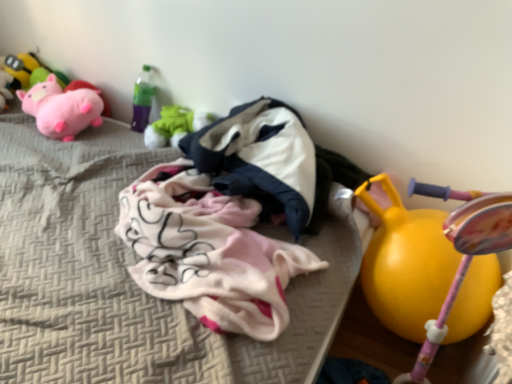
Image resolution: width=512 pixels, height=384 pixels. In order to click on rubber yellow ball at right, which is counted as the fifth toy, starting from the left in this screenshot , I will do `click(405, 262)`.

Measure the distance between rubber yellow ball at right, which is counted as the fifth toy, starting from the left, and camera.

The depth of rubber yellow ball at right, which is counted as the fifth toy, starting from the left, is 1.10 meters.

Measure the distance between point [346,256] and camera.

Point [346,256] is 4.04 feet from camera.

Describe the element at coordinates (21, 68) in the screenshot. The height and width of the screenshot is (384, 512). I see `matte yellow toy at upper left, which is counted as the 5th toy, starting from the right` at that location.

Locate an element on the screen. Image resolution: width=512 pixels, height=384 pixels. matte pink plush at upper left, the third toy from the left is located at coordinates (62, 108).

This screenshot has width=512, height=384. Find the location of `soft pink plush at upper left, positioned as the second toy in left-to-right order`. soft pink plush at upper left, positioned as the second toy in left-to-right order is located at coordinates (29, 71).

Considering the relative sizes of matte yellow toy at upper left, arranged as the first toy when viewed from the left, and matte pink plush at upper left, the third toy from the left, in the image provided, is matte yellow toy at upper left, arranged as the first toy when viewed from the left, wider than matte pink plush at upper left, the third toy from the left,?

Incorrect, the width of matte yellow toy at upper left, arranged as the first toy when viewed from the left, does not surpass that of matte pink plush at upper left, the third toy from the left.

Can you confirm if matte yellow toy at upper left, which is counted as the 5th toy, starting from the right, is shorter than matte pink plush at upper left, the third toy from the left?

In fact, matte yellow toy at upper left, which is counted as the 5th toy, starting from the right, may be taller than matte pink plush at upper left, the third toy from the left.

Is matte yellow toy at upper left, arranged as the first toy when viewed from the left, aimed at matte pink plush at upper left, the third toy from the left?

No, matte yellow toy at upper left, arranged as the first toy when viewed from the left, does not turn towards matte pink plush at upper left, the third toy from the left.

From the image's perspective, which is above, matte yellow toy at upper left, which is counted as the 5th toy, starting from the right, or matte pink plush at upper left, the third toy from the left?

From the image's view, matte yellow toy at upper left, which is counted as the 5th toy, starting from the right, is above.

Considering the sizes of objects rubber yellow ball at right, which is counted as the fifth toy, starting from the left, and white fabric at center in the image provided, who is smaller, rubber yellow ball at right, which is counted as the fifth toy, starting from the left, or white fabric at center?

rubber yellow ball at right, which is counted as the fifth toy, starting from the left, is smaller.

Is rubber yellow ball at right, which is counted as the fifth toy, starting from the left, taller or shorter than white fabric at center?

In the image, rubber yellow ball at right, which is counted as the fifth toy, starting from the left, appears to be taller than white fabric at center.

From the picture: Considering the positions of objects rubber yellow ball at right, which is counted as the fifth toy, starting from the left, and white fabric at center in the image provided, who is in front, rubber yellow ball at right, which is counted as the fifth toy, starting from the left, or white fabric at center?

white fabric at center is more forward.

Is the depth of soft pink plush at upper left, acting as the fourth toy starting from the right, less than that of rubber yellow ball at right, which is counted as the fifth toy, starting from the left?

No, it is not.

From a real-world perspective, relative to rubber yellow ball at right, placed as the 1th toy when sorted from right to left, is soft pink plush at upper left, positioned as the second toy in left-to-right order, vertically above or below?

soft pink plush at upper left, positioned as the second toy in left-to-right order, is situated higher than rubber yellow ball at right, placed as the 1th toy when sorted from right to left, in the real world.

Does point (58, 83) appear closer or farther from the camera than point (415, 277)?

Point (58, 83).

Does soft pink plush at upper left, acting as the fourth toy starting from the right, appear on the left side of rubber yellow ball at right, which is counted as the fifth toy, starting from the left?

Correct, you'll find soft pink plush at upper left, acting as the fourth toy starting from the right, to the left of rubber yellow ball at right, which is counted as the fifth toy, starting from the left.

Is point (117, 303) in front of point (263, 125)?

Yes, it is in front of point (263, 125).

Can you tell me how much white fabric at center and white cotton hoodie at center differ in facing direction?

2.96e-05 degrees.

From the image's perspective, is white fabric at center below white cotton hoodie at center?

Yes.

Does white fabric at center have a larger size compared to white cotton hoodie at center?

Correct, white fabric at center is larger in size than white cotton hoodie at center.

Considering the sizes of objects white cotton hoodie at center and white fabric at center in the image provided, who is taller, white cotton hoodie at center or white fabric at center?

Standing taller between the two is white cotton hoodie at center.

Which of these two, white cotton hoodie at center or white fabric at center, is smaller?

white cotton hoodie at center.

Which is more to the right, white cotton hoodie at center or white fabric at center?

From the viewer's perspective, white cotton hoodie at center appears more on the right side.

Could you tell me if white cotton hoodie at center is turned towards white fabric at center?

Yes, white cotton hoodie at center is aimed at white fabric at center.

Which is more to the left, white cotton hoodie at center or rubber yellow ball at right, placed as the 1th toy when sorted from right to left?

white cotton hoodie at center is more to the left.

From the picture: Is white cotton hoodie at center smaller than rubber yellow ball at right, which is counted as the fifth toy, starting from the left?

No, white cotton hoodie at center is not smaller than rubber yellow ball at right, which is counted as the fifth toy, starting from the left.

Is white cotton hoodie at center next to rubber yellow ball at right, which is counted as the fifth toy, starting from the left, and touching it?

No, white cotton hoodie at center is not next to rubber yellow ball at right, which is counted as the fifth toy, starting from the left.

What's the angular difference between white cotton hoodie at center and rubber yellow ball at right, which is counted as the fifth toy, starting from the left,'s facing directions?

There is a 1.08-degree angle between the facing directions of white cotton hoodie at center and rubber yellow ball at right, which is counted as the fifth toy, starting from the left.

Could you tell me if rubber yellow ball at right, which is counted as the fifth toy, starting from the left, is turned towards white cotton hoodie at center?

No, rubber yellow ball at right, which is counted as the fifth toy, starting from the left, is not facing towards white cotton hoodie at center.

Based on the photo, from the image's perspective, which one is positioned higher, rubber yellow ball at right, which is counted as the fifth toy, starting from the left, or white cotton hoodie at center?

white cotton hoodie at center appears higher in the image.

Considering the relative sizes of rubber yellow ball at right, placed as the 1th toy when sorted from right to left, and white cotton hoodie at center in the image provided, is rubber yellow ball at right, placed as the 1th toy when sorted from right to left, taller than white cotton hoodie at center?

Indeed, rubber yellow ball at right, placed as the 1th toy when sorted from right to left, has a greater height compared to white cotton hoodie at center.

Would you say rubber yellow ball at right, placed as the 1th toy when sorted from right to left, is to the left or to the right of white cotton hoodie at center in the picture?

Clearly, rubber yellow ball at right, placed as the 1th toy when sorted from right to left, is on the right of white cotton hoodie at center in the image.

Where is `toy that is the 2nd one above the matte pink plush at upper left, which ranks as the 3th toy in right-to-left order (from a real-world perspective)`? The image size is (512, 384). toy that is the 2nd one above the matte pink plush at upper left, which ranks as the 3th toy in right-to-left order (from a real-world perspective) is located at coordinates (21, 68).

Where is `the 1st toy behind the white fabric at center, starting your count from the anchor`? the 1st toy behind the white fabric at center, starting your count from the anchor is located at coordinates (405, 262).

From the image, which object appears to be nearer to rubber yellow ball at right, which is counted as the fifth toy, starting from the left, matte green plush toy at upper left, which appears as the fourth toy when viewed from the left, or white fabric at center?

Among the two, white fabric at center is located nearer to rubber yellow ball at right, which is counted as the fifth toy, starting from the left.

When comparing their distances from soft pink plush at upper left, positioned as the second toy in left-to-right order, does matte yellow toy at upper left, which is counted as the 5th toy, starting from the right, or matte pink plush at upper left, the third toy from the left, seem closer?

Among the two, matte yellow toy at upper left, which is counted as the 5th toy, starting from the right, is located nearer to soft pink plush at upper left, positioned as the second toy in left-to-right order.

Looking at the image, which one is located closer to matte yellow toy at upper left, which is counted as the 5th toy, starting from the right, matte pink plush at upper left, which ranks as the 3th toy in right-to-left order, or white cotton hoodie at center?

The object closer to matte yellow toy at upper left, which is counted as the 5th toy, starting from the right, is matte pink plush at upper left, which ranks as the 3th toy in right-to-left order.

Looking at this image, considering their positions, is matte pink plush at upper left, which ranks as the 3th toy in right-to-left order, positioned further to soft pink plush at upper left, positioned as the second toy in left-to-right order, than white cotton hoodie at center?

white cotton hoodie at center is further to soft pink plush at upper left, positioned as the second toy in left-to-right order.

Estimate the real-world distances between objects in this image. Which object is further from rubber yellow ball at right, placed as the 1th toy when sorted from right to left, matte pink plush at upper left, which ranks as the 3th toy in right-to-left order, or white fabric at center?

Based on the image, matte pink plush at upper left, which ranks as the 3th toy in right-to-left order, appears to be further to rubber yellow ball at right, placed as the 1th toy when sorted from right to left.

Estimate the real-world distances between objects in this image. Which object is further from matte green plush toy at upper left, marked as the 2th toy in a right-to-left arrangement, white fabric at center or soft pink plush at upper left, positioned as the second toy in left-to-right order?

soft pink plush at upper left, positioned as the second toy in left-to-right order, is positioned further to the anchor matte green plush toy at upper left, marked as the 2th toy in a right-to-left arrangement.

Considering their positions, is white cotton hoodie at center positioned further to matte pink plush at upper left, the third toy from the left, than matte yellow toy at upper left, which is counted as the 5th toy, starting from the right?

The object further to matte pink plush at upper left, the third toy from the left, is white cotton hoodie at center.

Which object lies further to the anchor point white fabric at center, matte yellow toy at upper left, arranged as the first toy when viewed from the left, or soft pink plush at upper left, acting as the fourth toy starting from the right?

matte yellow toy at upper left, arranged as the first toy when viewed from the left, is positioned further to the anchor white fabric at center.

I want to click on mattress between matte pink plush at upper left, the third toy from the left, and white cotton hoodie at center, in the horizontal direction, so click(x=129, y=277).

At what (x,y) coordinates should I click in order to perform the action: click on mattress between matte pink plush at upper left, the third toy from the left, and rubber yellow ball at right, placed as the 1th toy when sorted from right to left, in the horizontal direction. Please return your answer as a coordinate pair (x, y). Looking at the image, I should click on (129, 277).

The height and width of the screenshot is (384, 512). Find the location of `toy between matte pink plush at upper left, the third toy from the left, and white cotton hoodie at center, in the horizontal direction`. toy between matte pink plush at upper left, the third toy from the left, and white cotton hoodie at center, in the horizontal direction is located at coordinates (175, 126).

The height and width of the screenshot is (384, 512). I want to click on mattress between matte green plush toy at upper left, marked as the 2th toy in a right-to-left arrangement, and rubber yellow ball at right, placed as the 1th toy when sorted from right to left, so click(129, 277).